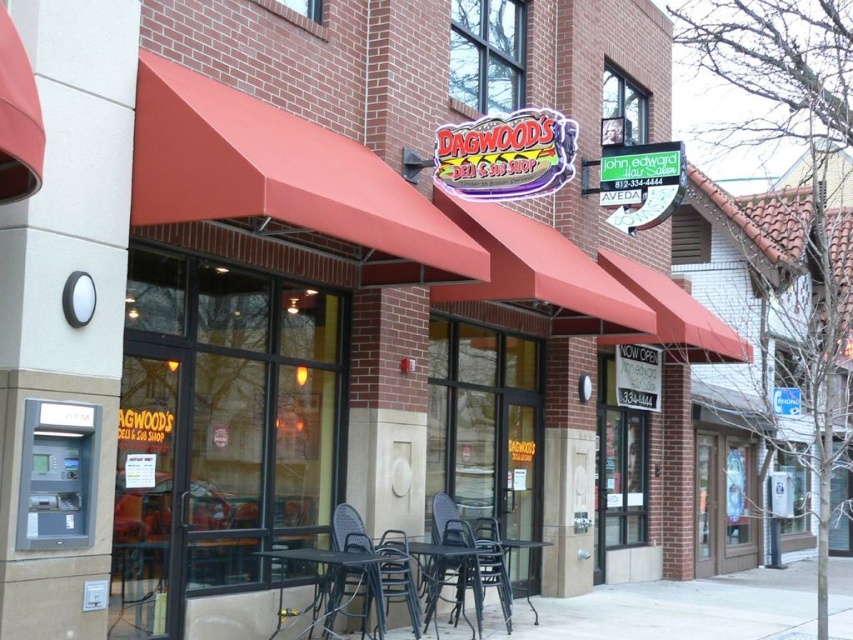
Question: Does black plastic chair at center come behind black metal table at lower center?

Choices:
 (A) yes
 (B) no

Answer: (A)

Question: Does black metal table at lower center lie in front of metallic black table at lower center?

Choices:
 (A) no
 (B) yes

Answer: (B)

Question: Which object is the closest to the black metal table at lower center?

Choices:
 (A) metallic black table at center
 (B) rattan chair at lower center
 (C) black plastic chair at center
 (D) metallic black table at lower center

Answer: (B)

Question: Among these objects, which one is nearest to the camera?

Choices:
 (A) rattan chair at lower center
 (B) black plastic chair at center

Answer: (A)

Question: Which of these objects is positioned closest to the rattan chair at lower center?

Choices:
 (A) black plastic chair at center
 (B) metallic black table at center
 (C) black metal table at lower center
 (D) metallic black table at lower center

Answer: (C)

Question: In this image, where is rattan chair at lower center located relative to metallic black table at center?

Choices:
 (A) left
 (B) right

Answer: (A)